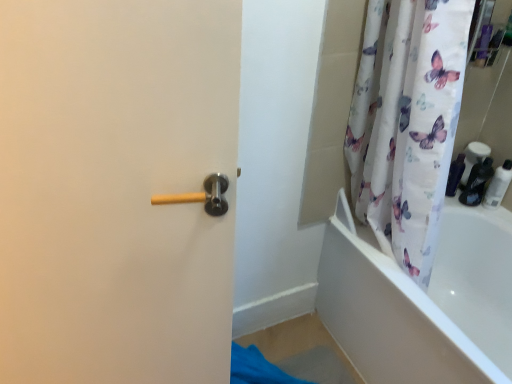
Question: Does white glossy bottle at right, the 1th toiletry positioned from the right, touch matte black toiletries at right, which is counted as the second toiletry, starting from the right?

Choices:
 (A) yes
 (B) no

Answer: (A)

Question: Can you confirm if white glossy bottle at right, the 1th toiletry positioned from the right, is bigger than matte black toiletries at right, the second toiletry viewed from the left?

Choices:
 (A) no
 (B) yes

Answer: (A)

Question: From a real-world perspective, is white glossy bottle at right, the 1th toiletry positioned from the right, located beneath matte black toiletries at right, which is counted as the second toiletry, starting from the right?

Choices:
 (A) no
 (B) yes

Answer: (A)

Question: Can you confirm if white glossy bottle at right, placed as the 3th toiletry when sorted from left to right, is shorter than matte black toiletries at right, which is counted as the second toiletry, starting from the right?

Choices:
 (A) yes
 (B) no

Answer: (A)

Question: Is white glossy bottle at right, placed as the 3th toiletry when sorted from left to right, thinner than matte black toiletries at right, the second toiletry viewed from the left?

Choices:
 (A) yes
 (B) no

Answer: (A)

Question: Is matte black toiletries at right, the second toiletry viewed from the left, surrounded by white glossy bottle at right, placed as the 3th toiletry when sorted from left to right?

Choices:
 (A) no
 (B) yes

Answer: (A)

Question: Is the depth of matte black bottle at right, which appears as the 1th toiletry when viewed from the left, less than that of matte black toiletries at right, the second toiletry viewed from the left?

Choices:
 (A) yes
 (B) no

Answer: (B)

Question: Considering the relative positions of matte black bottle at right, which appears as the 1th toiletry when viewed from the left, and matte black toiletries at right, the second toiletry viewed from the left, in the image provided, is matte black bottle at right, which appears as the 1th toiletry when viewed from the left, behind matte black toiletries at right, the second toiletry viewed from the left,?

Choices:
 (A) yes
 (B) no

Answer: (A)

Question: Can you confirm if matte black bottle at right, which appears as the 1th toiletry when viewed from the left, is smaller than matte black toiletries at right, the second toiletry viewed from the left?

Choices:
 (A) yes
 (B) no

Answer: (A)

Question: Does matte black bottle at right, the 3th toiletry when ordered from right to left, have a larger size compared to matte black toiletries at right, the second toiletry viewed from the left?

Choices:
 (A) no
 (B) yes

Answer: (A)

Question: Is matte black toiletries at right, the second toiletry viewed from the left, inside matte black bottle at right, which appears as the 1th toiletry when viewed from the left?

Choices:
 (A) no
 (B) yes

Answer: (A)

Question: From a real-world perspective, is matte black bottle at right, which appears as the 1th toiletry when viewed from the left, positioned under matte black toiletries at right, which is counted as the second toiletry, starting from the right, based on gravity?

Choices:
 (A) yes
 (B) no

Answer: (A)

Question: Is matte black toiletries at right, which is counted as the second toiletry, starting from the right, thinner than white glossy bottle at right, the 1th toiletry positioned from the right?

Choices:
 (A) no
 (B) yes

Answer: (A)